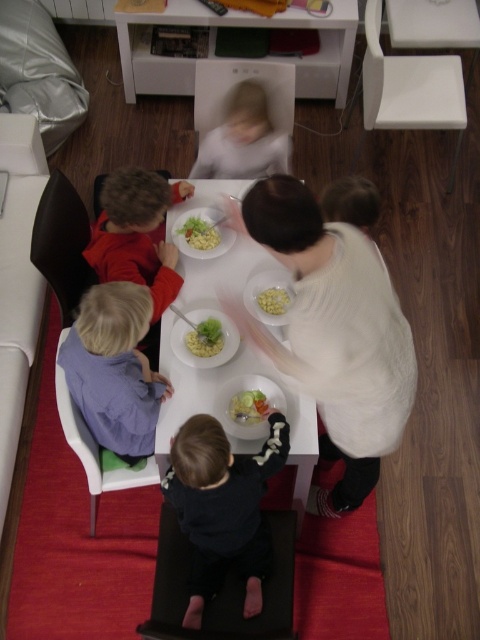
You are a parent preparing to place a 12 inch wide decorative plate on the table. The plate must be placed entirely on the table. Given the white glossy table at center and the smooth white bowl at center, can you confirm if the table is wide enough to accommodate the plate?

The white glossy table at center is wider than the smooth white bowl at center. However, the exact width of the table isn not provided. Without knowing the table width or the bowl width, it is impossible to determine if the table can fit a 12 inch plate.

You are a parent preparing lunch for your children. You have a yellow matte pasta bowl at center and a smooth plastic container at center on the table. Which container can hold more food?

The yellow matte pasta bowl at center has a larger size compared to the smooth plastic container at center, so it can hold more food.